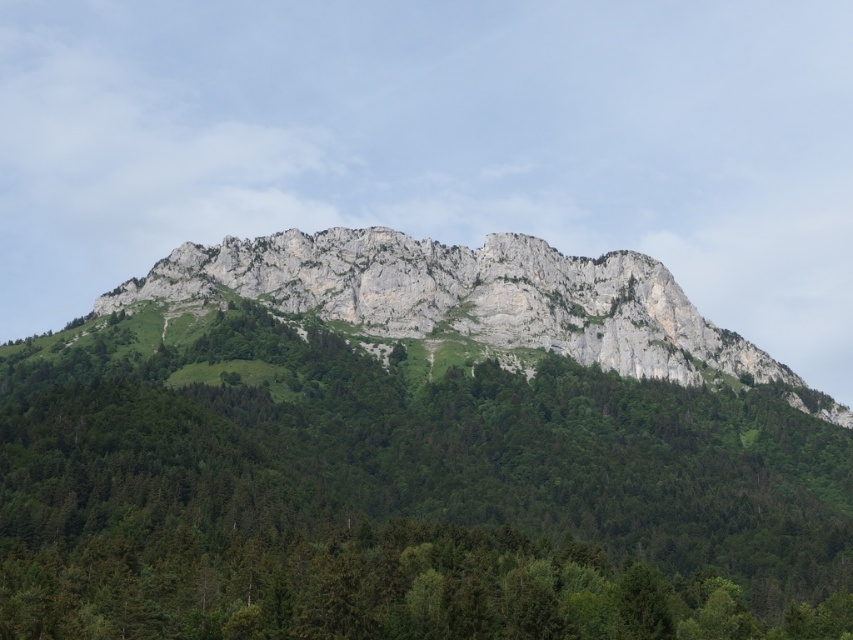
Question: Among these objects, which one is farthest from the camera?

Choices:
 (A) green leafy trees at center
 (B) rugged stone mountain at center

Answer: (B)

Question: Does green leafy trees at center have a greater width compared to rugged stone mountain at center?

Choices:
 (A) no
 (B) yes

Answer: (A)

Question: Is green leafy trees at center positioned in front of rugged stone mountain at center?

Choices:
 (A) yes
 (B) no

Answer: (A)

Question: From the image, what is the correct spatial relationship of green leafy trees at center in relation to rugged stone mountain at center?

Choices:
 (A) above
 (B) below

Answer: (B)

Question: Which object appears closest to the camera in this image?

Choices:
 (A) rugged stone mountain at center
 (B) green leafy trees at center

Answer: (B)